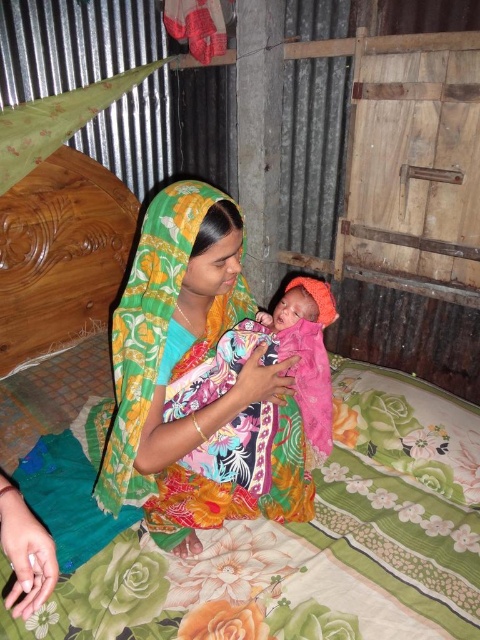
Question: Which of the following is the closest to the observer?

Choices:
 (A) floral fabric quilt at center
 (B) orange fabric swaddle at center
 (C) floral fabric cloth at center

Answer: (C)

Question: Is floral fabric cloth at center smaller than orange fabric swaddle at center?

Choices:
 (A) no
 (B) yes

Answer: (A)

Question: Which object appears closest to the camera in this image?

Choices:
 (A) orange fabric swaddle at center
 (B) floral fabric cloth at center
 (C) floral fabric quilt at center

Answer: (B)

Question: Among these points, which one is farthest from the camera?

Choices:
 (A) (295, 602)
 (B) (152, 483)
 (C) (299, 396)

Answer: (C)

Question: Is floral fabric quilt at center below orange fabric swaddle at center?

Choices:
 (A) no
 (B) yes

Answer: (B)

Question: Observing the image, what is the correct spatial positioning of floral fabric cloth at center in reference to orange fabric swaddle at center?

Choices:
 (A) right
 (B) left

Answer: (B)